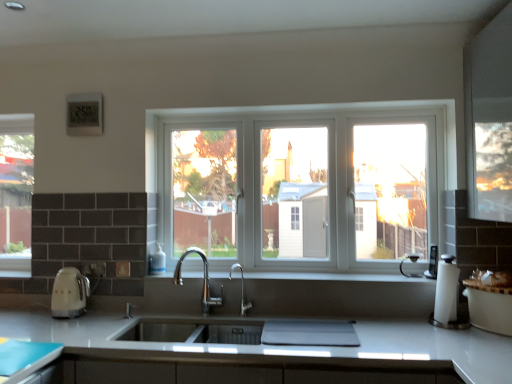
What do you see at coordinates (447, 296) in the screenshot? The image size is (512, 384). I see `white glossy coffee machine at right` at bounding box center [447, 296].

The width and height of the screenshot is (512, 384). Identify the location of white plastic phone at right, which ranks as the 1th appliance in right-to-left order. (432, 263).

What do you see at coordinates (25, 358) in the screenshot?
I see `matte white countertop at lower left` at bounding box center [25, 358].

You are a GUI agent. You are given a task and a screenshot of the screen. Output one action in this format:
    pyautogui.click(x=<x>, y=<y>)
    Task: Click on the white smooth window sill at center
    This screenshot has width=512, height=384.
    Given the screenshot: What is the action you would take?
    pyautogui.click(x=335, y=277)

Find the location of a particular element. The height and width of the screenshot is (384, 512). clear glass window at left, the 2th window positioned from the front is located at coordinates (16, 193).

Image resolution: width=512 pixels, height=384 pixels. Describe the element at coordinates (16, 193) in the screenshot. I see `clear glass window at left, the 2th window positioned from the front` at that location.

Find the location of a particular element. polished chrome faucet at center is located at coordinates (203, 279).

Locate an element on the screen. The width and height of the screenshot is (512, 384). white glossy coffee machine at right is located at coordinates (447, 296).

Is white plastic phone at right, which ranks as the 1th appliance in right-to-left order, looking in the opposite direction of white plastic window at center, which appears as the 2th window when viewed from the back?

Yes, white plastic phone at right, which ranks as the 1th appliance in right-to-left order, is facing away from white plastic window at center, which appears as the 2th window when viewed from the back.

Find the location of a particular element. The image size is (512, 384). the 1st appliance in front of the white plastic window at center, the 2th window from the left is located at coordinates (432, 263).

Between point (433, 247) and point (240, 122), which one is positioned in front?

The point (433, 247) is in front.

Image resolution: width=512 pixels, height=384 pixels. Identify the location of window sill behind the white glossy coffee machine at right. (335, 277).

Consider the image. Is the position of white glossy coffee machine at right more distant than that of white smooth window sill at center?

No, it is not.

Is white glossy coffee machine at right next to white smooth window sill at center?

There is a gap between white glossy coffee machine at right and white smooth window sill at center.

Is white glossy coffee machine at right oriented away from white smooth window sill at center?

Absolutely, white glossy coffee machine at right is directed away from white smooth window sill at center.

Consider the image. Would you consider white smooth window sill at center to be distant from matte cream kettle at left, arranged as the 2th appliance when viewed from the right?

No, white smooth window sill at center is not far from matte cream kettle at left, arranged as the 2th appliance when viewed from the right.

From a real-world perspective, does white smooth window sill at center stand above matte cream kettle at left, arranged as the 2th appliance when viewed from the right?

Correct, in the physical world, white smooth window sill at center is higher than matte cream kettle at left, arranged as the 2th appliance when viewed from the right.

Can you confirm if white smooth window sill at center is wider than matte cream kettle at left, positioned as the 1th appliance in left-to-right order?

Indeed, white smooth window sill at center has a greater width compared to matte cream kettle at left, positioned as the 1th appliance in left-to-right order.

Between polished chrome faucet at center and clear glass window at left, which is the first window from back to front, which one has less height?

polished chrome faucet at center is shorter.

Does point (202, 253) come closer to viewer compared to point (0, 132)?

No, it is behind (0, 132).

In the scene shown: Which object is thinner, polished chrome faucet at center or clear glass window at left, which is the first window from back to front?

clear glass window at left, which is the first window from back to front.

In the scene shown: Between polished chrome faucet at center and clear glass window at left, positioned as the first window in left-to-right order, which one appears on the left side from the viewer's perspective?

clear glass window at left, positioned as the first window in left-to-right order, is more to the left.

From a real-world perspective, is clear glass window at left, positioned as the first window in left-to-right order, beneath white plastic phone at right, the 2th appliance in the left-to-right sequence?

No.

Who is smaller, clear glass window at left, the second window viewed from the right, or white plastic phone at right, which ranks as the 1th appliance in right-to-left order?

white plastic phone at right, which ranks as the 1th appliance in right-to-left order, is smaller.

From the image's perspective, is clear glass window at left, the 2th window positioned from the front, on top of white plastic phone at right, which ranks as the 1th appliance in right-to-left order?

Yes, from the image's perspective, clear glass window at left, the 2th window positioned from the front, is on top of white plastic phone at right, which ranks as the 1th appliance in right-to-left order.

Who is taller, clear glass window at left, the second window viewed from the right, or white plastic phone at right, which ranks as the 1th appliance in right-to-left order?

clear glass window at left, the second window viewed from the right, is taller.

Which of these two, white glossy coffee machine at right or white glossy countertop at center, is wider?

white glossy countertop at center.

Which is farther from the camera, (440, 290) or (476, 345)?

Positioned behind is point (440, 290).

Identify the location of countertop in front of the white glossy coffee machine at right. The height and width of the screenshot is (384, 512). pos(418,348).

From a real-world perspective, is white glossy coffee machine at right physically located above or below white glossy countertop at center?

From a real-world perspective, white glossy coffee machine at right is physically above white glossy countertop at center.

You are a GUI agent. You are given a task and a screenshot of the screen. Output one action in this format:
    pyautogui.click(x=<x>, y=<y>)
    Task: Click on the window that appears below the white plastic window at center, placed as the first window when sorted from front to back (from the image's perspective)
    
    Given the screenshot: What is the action you would take?
    pos(16,193)

Does clear glass window at left, the second window viewed from the right, have a larger size compared to white plastic window at center, which appears as the first window when viewed from the right?

Incorrect, clear glass window at left, the second window viewed from the right, is not larger than white plastic window at center, which appears as the first window when viewed from the right.

Is clear glass window at left, the 2th window positioned from the front, touching white plastic window at center, placed as the first window when sorted from front to back?

There is a gap between clear glass window at left, the 2th window positioned from the front, and white plastic window at center, placed as the first window when sorted from front to back.

Does clear glass window at left, positioned as the first window in left-to-right order, have a lesser width compared to white plastic window at center, which appears as the first window when viewed from the right?

Incorrect, the width of clear glass window at left, positioned as the first window in left-to-right order, is not less than that of white plastic window at center, which appears as the first window when viewed from the right.

Where is `appliance on the right of the white plastic window at center, which appears as the first window when viewed from the right`? This screenshot has height=384, width=512. appliance on the right of the white plastic window at center, which appears as the first window when viewed from the right is located at coordinates (432, 263).

Where is `window sill to the left of white glossy coffee machine at right`? window sill to the left of white glossy coffee machine at right is located at coordinates (335, 277).

When comparing their distances from white glossy countertop at center, does white glossy coffee machine at right or polished chrome faucet at center seem further?

polished chrome faucet at center is positioned further to the anchor white glossy countertop at center.

Looking at this image, based on their spatial positions, is matte white countertop at lower left or white plastic phone at right, which ranks as the 1th appliance in right-to-left order, further from white glossy countertop at center?

Among the two, matte white countertop at lower left is located further to white glossy countertop at center.

When comparing their distances from matte cream kettle at left, arranged as the 2th appliance when viewed from the right, does matte white countertop at lower left or white smooth window sill at center seem further?

white smooth window sill at center lies further to matte cream kettle at left, arranged as the 2th appliance when viewed from the right, than the other object.

Which object lies further to the anchor point polished chrome faucet at center, matte white countertop at lower left or white plastic window at center, the 2th window from the left?

Among the two, matte white countertop at lower left is located further to polished chrome faucet at center.

From the image, which object appears to be nearer to polished chrome faucet at center, white plastic window at center, which appears as the first window when viewed from the right, or white smooth window sill at center?

The object closer to polished chrome faucet at center is white smooth window sill at center.

From the image, which object appears to be farther from matte cream kettle at left, arranged as the 2th appliance when viewed from the right, clear glass window at left, the second window viewed from the right, or white glossy coffee machine at right?

Among the two, white glossy coffee machine at right is located further to matte cream kettle at left, arranged as the 2th appliance when viewed from the right.

Considering their positions, is white plastic window at center, which appears as the 2th window when viewed from the back, positioned further to matte white countertop at lower left than white smooth window sill at center?

Among the two, white plastic window at center, which appears as the 2th window when viewed from the back, is located further to matte white countertop at lower left.

Estimate the real-world distances between objects in this image. Which object is closer to white plastic phone at right, which ranks as the 1th appliance in right-to-left order, white smooth window sill at center or matte white countertop at lower left?

The object closer to white plastic phone at right, which ranks as the 1th appliance in right-to-left order, is white smooth window sill at center.

Image resolution: width=512 pixels, height=384 pixels. I want to click on window sill between white glossy countertop at center and white plastic phone at right, which ranks as the 1th appliance in right-to-left order, in the horizontal direction, so click(335, 277).

Locate an element on the screen. window situated between polished chrome faucet at center and white glossy coffee machine at right from left to right is located at coordinates (302, 183).

Find the location of a particular element. This screenshot has height=384, width=512. tap located between matte cream kettle at left, positioned as the 1th appliance in left-to-right order, and white plastic phone at right, which ranks as the 1th appliance in right-to-left order, in the left-right direction is located at coordinates (203, 279).

Locate an element on the screen. countertop between matte cream kettle at left, positioned as the 1th appliance in left-to-right order, and white glossy coffee machine at right, in the horizontal direction is located at coordinates (418, 348).